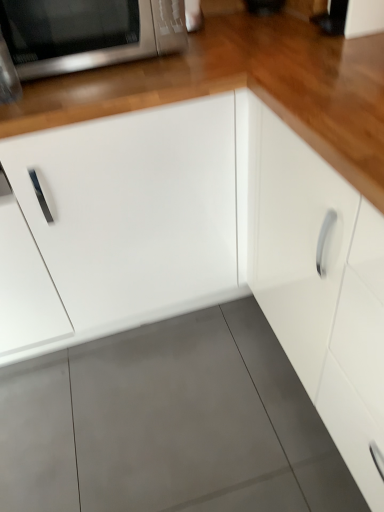
Question: Is the position of white matte cabinet at center, the second cabinetry viewed from the right, more distant than that of white glossy cabinet at center, positioned as the second cabinetry in left-to-right order?

Choices:
 (A) no
 (B) yes

Answer: (B)

Question: Considering the relative sizes of white matte cabinet at center, the second cabinetry viewed from the right, and white glossy cabinet at center, positioned as the second cabinetry in left-to-right order, in the image provided, is white matte cabinet at center, the second cabinetry viewed from the right, shorter than white glossy cabinet at center, positioned as the second cabinetry in left-to-right order,?

Choices:
 (A) yes
 (B) no

Answer: (A)

Question: From the image's perspective, is white matte cabinet at center, the second cabinetry viewed from the right, under white glossy cabinet at center, positioned as the second cabinetry in left-to-right order?

Choices:
 (A) yes
 (B) no

Answer: (B)

Question: Considering the relative sizes of white matte cabinet at center, which is counted as the 1th cabinetry, starting from the left, and white glossy cabinet at center, the 1th cabinetry from the right, in the image provided, is white matte cabinet at center, which is counted as the 1th cabinetry, starting from the left, bigger than white glossy cabinet at center, the 1th cabinetry from the right,?

Choices:
 (A) no
 (B) yes

Answer: (A)

Question: Is white matte cabinet at center, the second cabinetry viewed from the right, aimed at white glossy cabinet at center, positioned as the second cabinetry in left-to-right order?

Choices:
 (A) no
 (B) yes

Answer: (A)

Question: Would you say satin silver microwave at upper left is to the left or to the right of white matte cabinet at center, the second cabinetry viewed from the right, in the picture?

Choices:
 (A) right
 (B) left

Answer: (B)

Question: From the image's perspective, relative to white matte cabinet at center, the second cabinetry viewed from the right, is satin silver microwave at upper left above or below?

Choices:
 (A) above
 (B) below

Answer: (A)

Question: Is satin silver microwave at upper left inside or outside of white matte cabinet at center, the second cabinetry viewed from the right?

Choices:
 (A) inside
 (B) outside

Answer: (B)

Question: Is point (74, 65) positioned closer to the camera than point (200, 179)?

Choices:
 (A) farther
 (B) closer

Answer: (B)

Question: Is point (240, 144) closer or farther from the camera than point (69, 317)?

Choices:
 (A) closer
 (B) farther

Answer: (A)

Question: Considering the positions of white glossy cabinet at center, positioned as the second cabinetry in left-to-right order, and white matte cabinet at center, which is counted as the 1th cabinetry, starting from the left, in the image, is white glossy cabinet at center, positioned as the second cabinetry in left-to-right order, wider or thinner than white matte cabinet at center, which is counted as the 1th cabinetry, starting from the left,?

Choices:
 (A) thin
 (B) wide

Answer: (A)

Question: Is white glossy cabinet at center, positioned as the second cabinetry in left-to-right order, situated inside white matte cabinet at center, the second cabinetry viewed from the right, or outside?

Choices:
 (A) outside
 (B) inside

Answer: (A)

Question: Considering the relative positions of white glossy cabinet at center, the 1th cabinetry from the right, and white matte cabinet at center, the second cabinetry viewed from the right, in the image provided, is white glossy cabinet at center, the 1th cabinetry from the right, to the left or to the right of white matte cabinet at center, the second cabinetry viewed from the right,?

Choices:
 (A) left
 (B) right

Answer: (B)

Question: Considering their positions, is white matte cabinet at center, the second cabinetry viewed from the right, located in front of or behind white glossy cabinet at center, positioned as the second cabinetry in left-to-right order?

Choices:
 (A) front
 (B) behind

Answer: (B)

Question: In terms of width, does white matte cabinet at center, which is counted as the 1th cabinetry, starting from the left, look wider or thinner when compared to white glossy cabinet at center, positioned as the second cabinetry in left-to-right order?

Choices:
 (A) wide
 (B) thin

Answer: (A)